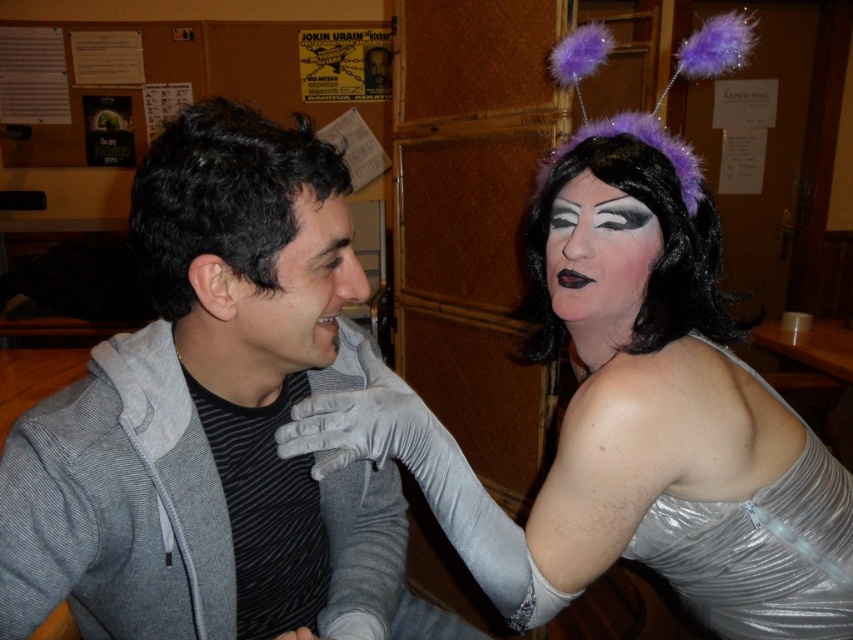
Question: Is gray hoodie at left thinner than matte gray hoodie at center?

Choices:
 (A) no
 (B) yes

Answer: (A)

Question: Which object is positioned farthest from the matte gray hoodie at center?

Choices:
 (A) shiny silver dress at center
 (B) gray hoodie at left

Answer: (A)

Question: Which of these objects is positioned closest to the shiny silver dress at center?

Choices:
 (A) gray hoodie at left
 (B) matte gray hoodie at center

Answer: (A)

Question: In this image, where is matte gray hoodie at center located relative to matte silver face at upper right?

Choices:
 (A) below
 (B) above

Answer: (A)

Question: In this image, where is gray hoodie at left located relative to shiny silver dress at center?

Choices:
 (A) above
 (B) below

Answer: (B)

Question: Which of the following is the farthest from the observer?

Choices:
 (A) shiny silver dress at center
 (B) matte silver face at upper right
 (C) gray hoodie at left
 (D) matte gray hoodie at center

Answer: (B)